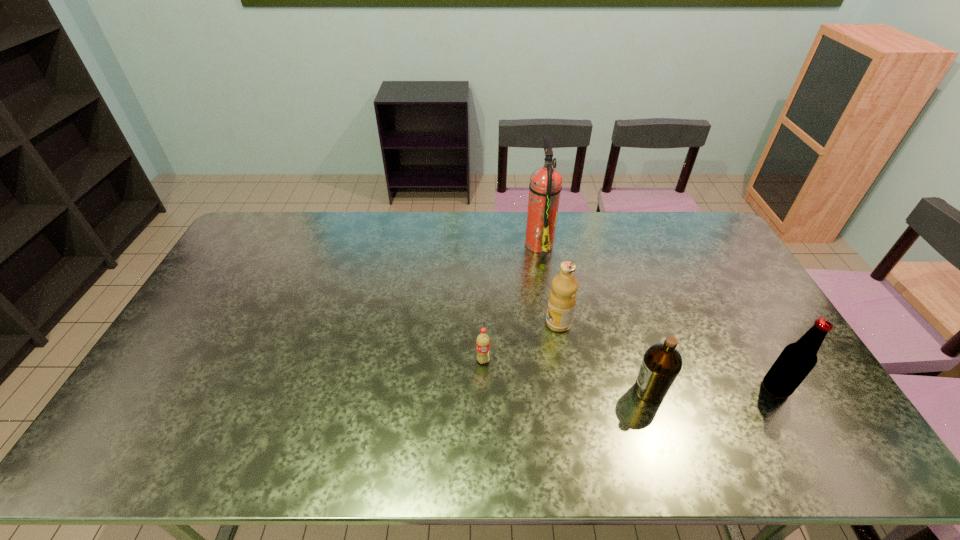
This screenshot has height=540, width=960. What are the coordinates of `free space that satisfies the following two spatial constraints: 1. on the back side of the beer bottle; 2. at the nozzle of the fire extinguisher` in the screenshot? It's located at (694, 243).

The image size is (960, 540). Find the location of `vacant region that satisfies the following two spatial constraints: 1. on the label of the beer bottle; 2. on the left side of the farther olive oil`. vacant region that satisfies the following two spatial constraints: 1. on the label of the beer bottle; 2. on the left side of the farther olive oil is located at coordinates (569, 388).